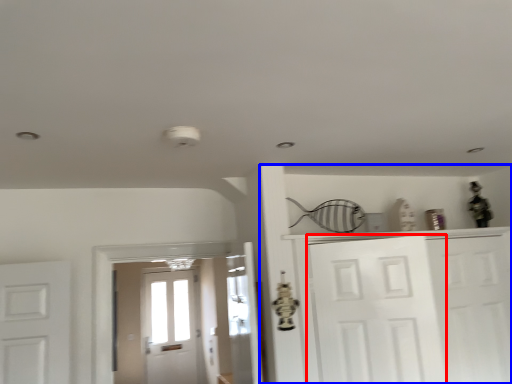
Question: Among these objects, which one is farthest to the camera, door (highlighted by a red box) or dresser (highlighted by a blue box)?

Choices:
 (A) door
 (B) dresser

Answer: (B)